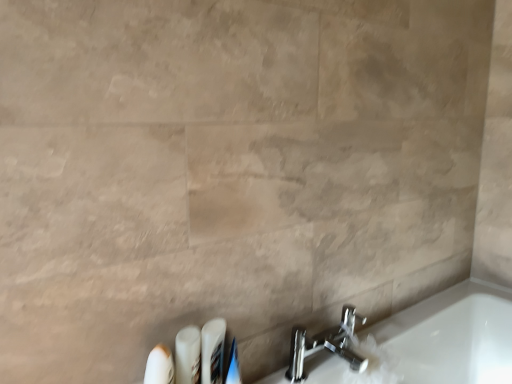
Question: From the image's perspective, is white plastic toothbrushes at lower center, the second toiletry from the right, positioned above or below white glossy toothpaste at lower center, which is the 1th toiletry in right-to-left order?

Choices:
 (A) above
 (B) below

Answer: (A)

Question: Looking at their shapes, would you say white plastic toothbrushes at lower center, the third toiletry positioned from the left, is wider or thinner than white glossy toothpaste at lower center, which is the 1th toiletry in right-to-left order?

Choices:
 (A) thin
 (B) wide

Answer: (B)

Question: Which is farther from the white glossy toothpaste at lower center, which is the 1th toiletry in right-to-left order?

Choices:
 (A) polished chrome faucet at lower right
 (B) white plastic toothbrushes at lower center, the third toiletry positioned from the left
 (C) white glossy tube at lower center, the third toiletry positioned from the right
 (D) white plastic toothbrush at lower left, the first toiletry from the left

Answer: (A)

Question: Which is farther from the white glossy toothpaste at lower center, which appears as the 4th toiletry when viewed from the left?

Choices:
 (A) white plastic toothbrush at lower left, the 4th toiletry from the right
 (B) polished chrome faucet at lower right
 (C) white glossy tube at lower center, the third toiletry positioned from the right
 (D) white plastic toothbrushes at lower center, the second toiletry from the right

Answer: (B)